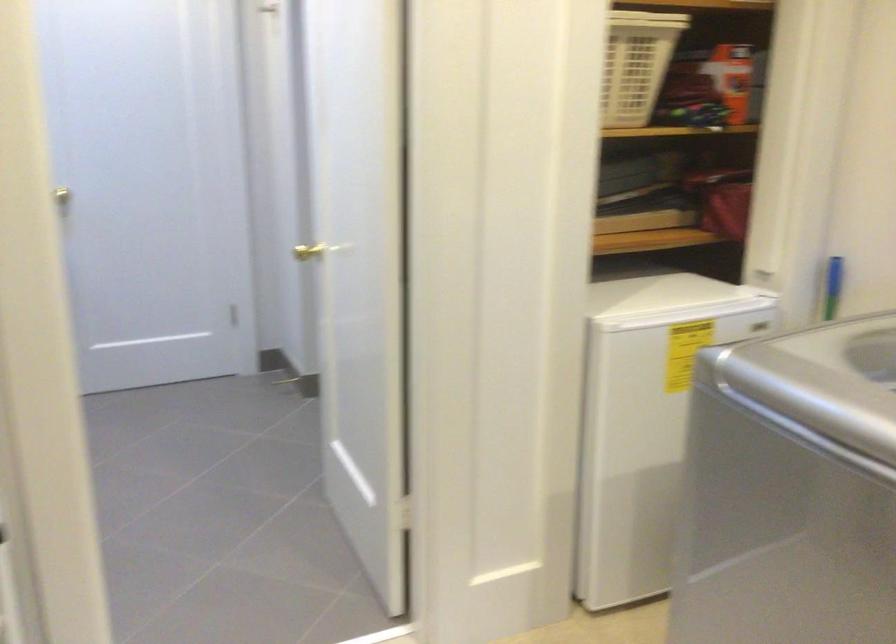
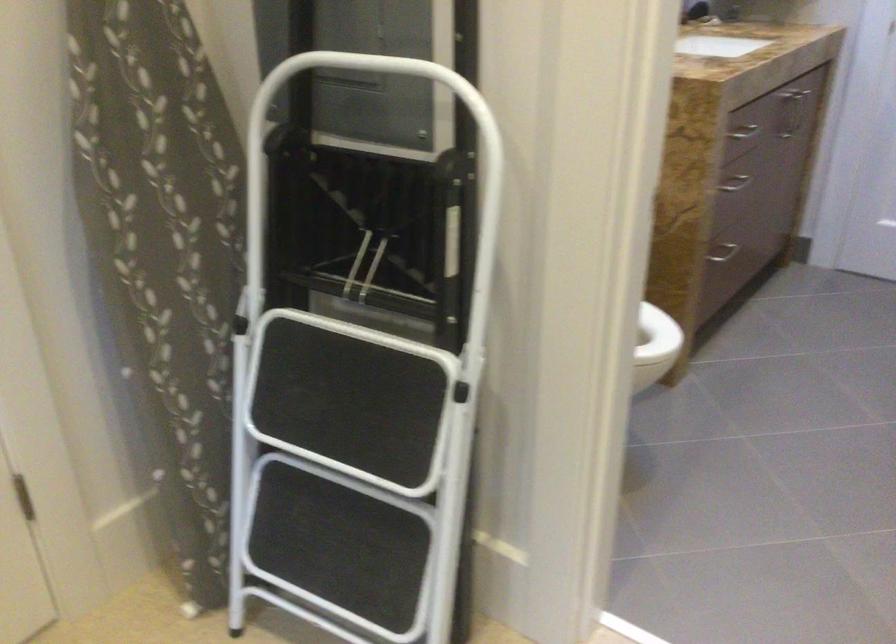
The first image is from the beginning of the video and the second image is from the end. How did the camera likely rotate when shooting the video?

The camera rotated toward left-down.